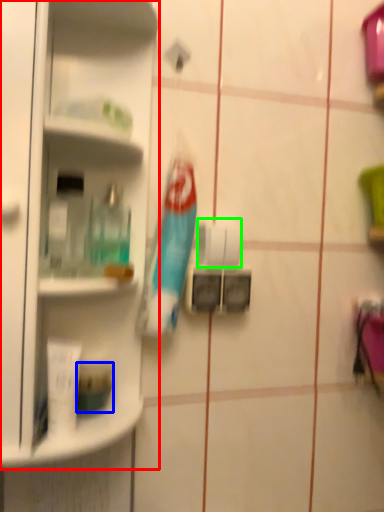
Question: Which object is positioned farthest from shelf (highlighted by a red box)? Select from toiletry (highlighted by a blue box) and toilet paper (highlighted by a green box).

Choices:
 (A) toiletry
 (B) toilet paper

Answer: (A)